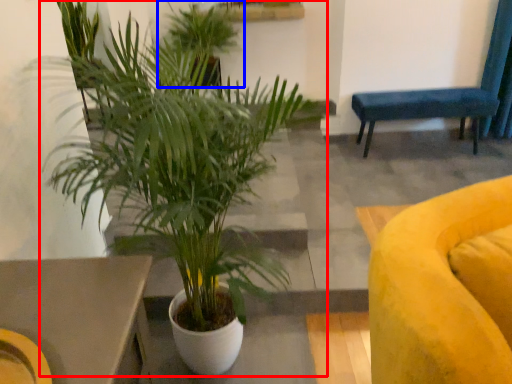
Question: Which object appears farthest to the camera in this image, houseplant (highlighted by a red box) or houseplant (highlighted by a blue box)?

Choices:
 (A) houseplant
 (B) houseplant

Answer: (B)